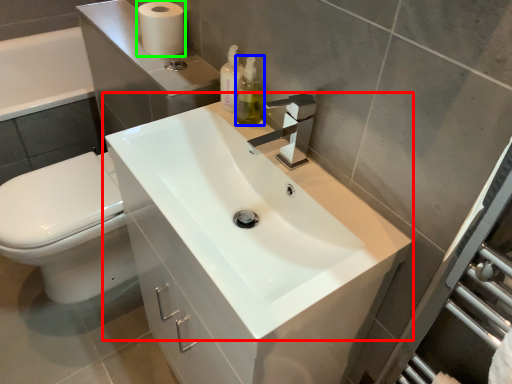
Question: Based on their relative distances, which object is farther from sink (highlighted by a red box)? Choose from soap dispenser (highlighted by a blue box) and toilet paper (highlighted by a green box).

Choices:
 (A) soap dispenser
 (B) toilet paper

Answer: (B)